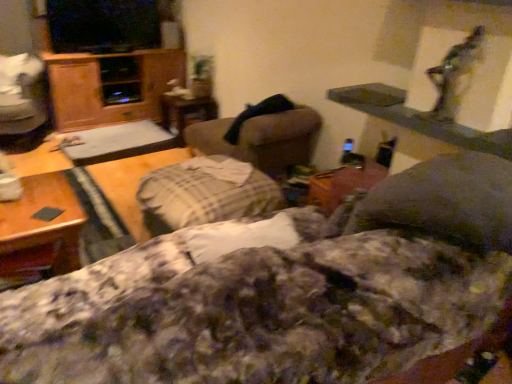
Question: Is wooden cabinet at left inside the boundaries of wooden table at center, acting as the fourth table starting from the right, or outside?

Choices:
 (A) inside
 (B) outside

Answer: (B)

Question: Based on their positions, is wooden cabinet at left located to the left or right of wooden table at center, arranged as the first table when viewed from the left?

Choices:
 (A) right
 (B) left

Answer: (B)

Question: Which object is the closest to the wooden table at upper right, which is the fourth table from back to front?

Choices:
 (A) brown wooden table at lower left, which ranks as the 3th table in back-to-front order
 (B) wooden cabinet at left
 (C) fluffy cotton blanket at center
 (D) wooden table at center, which is the fourth table from front to back
 (E) wooden swivel chair at left, the 1th swivel chair when ordered from left to right

Answer: (C)

Question: Based on their relative distances, which object is farther from the brown wooden table at lower left, the 3th table when ordered from right to left?

Choices:
 (A) wooden swivel chair at left, arranged as the 1th swivel chair when viewed from the back
 (B) fluffy cotton blanket at center
 (C) wooden table at center, positioned as the second table in back-to-front order
 (D) plush beige swivel chair at center, positioned as the first swivel chair in right-to-left order
 (E) wooden table at center, which is the fourth table from front to back

Answer: (E)